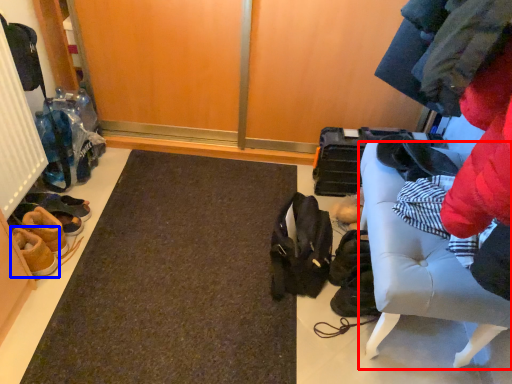
Question: Which object is closer to the camera taking this photo, furniture (highlighted by a red box) or footwear (highlighted by a blue box)?

Choices:
 (A) furniture
 (B) footwear

Answer: (A)